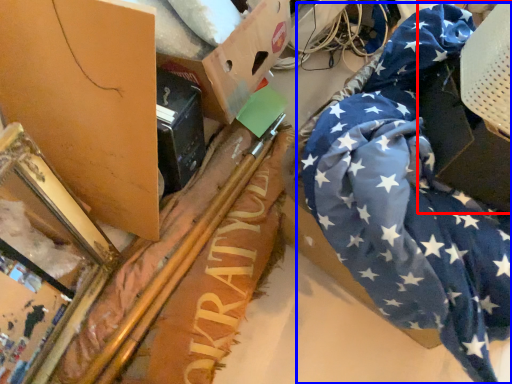
Question: Among these objects, which one is nearest to the camera, cardboard box (highlighted by a red box) or flag (highlighted by a blue box)?

Choices:
 (A) cardboard box
 (B) flag

Answer: (B)